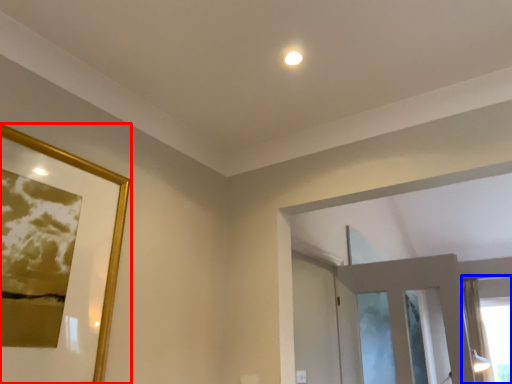
Question: Which of the following is the farthest to the observer, picture frame (highlighted by a red box) or window (highlighted by a blue box)?

Choices:
 (A) picture frame
 (B) window

Answer: (B)